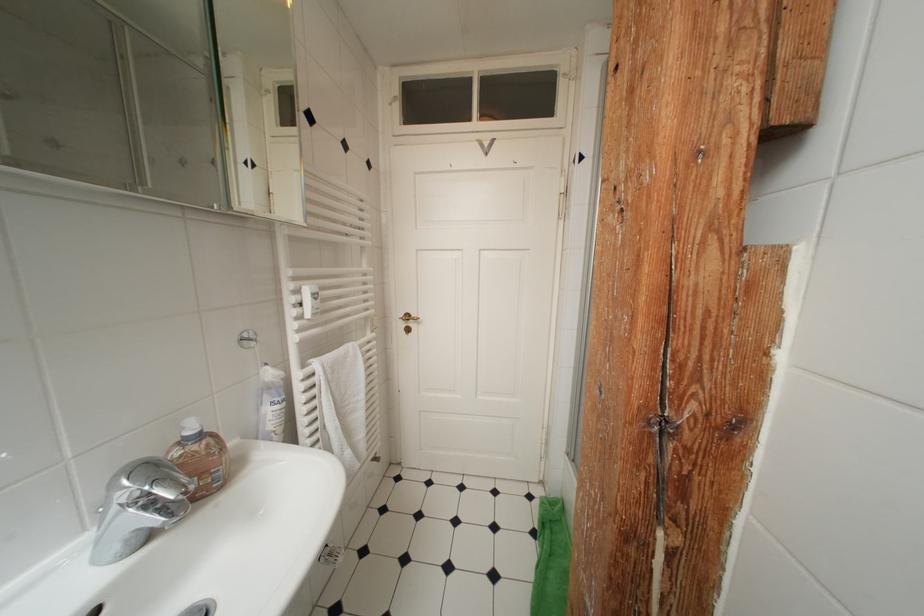
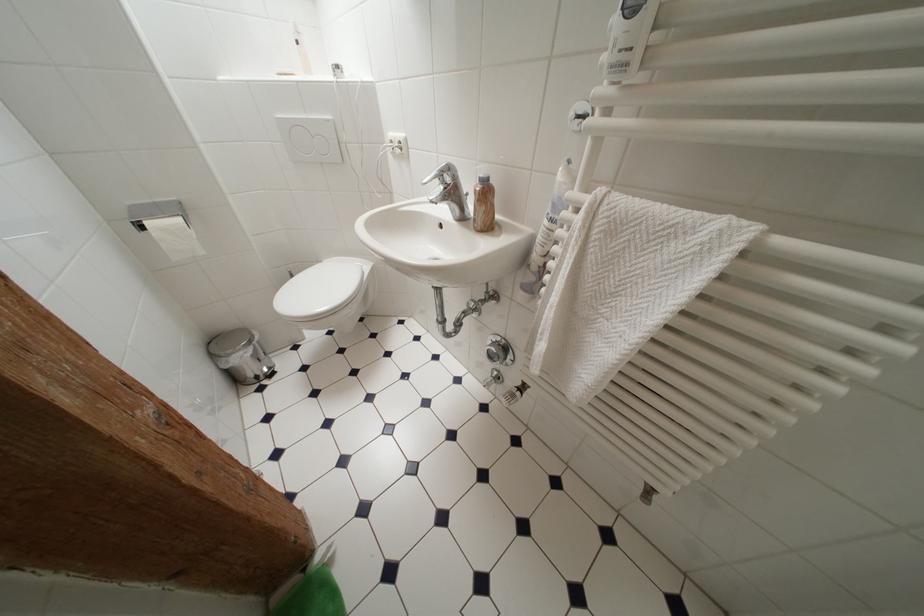
The point at (348,440) is marked in the first image. Where is the corresponding point in the second image?

(555, 325)